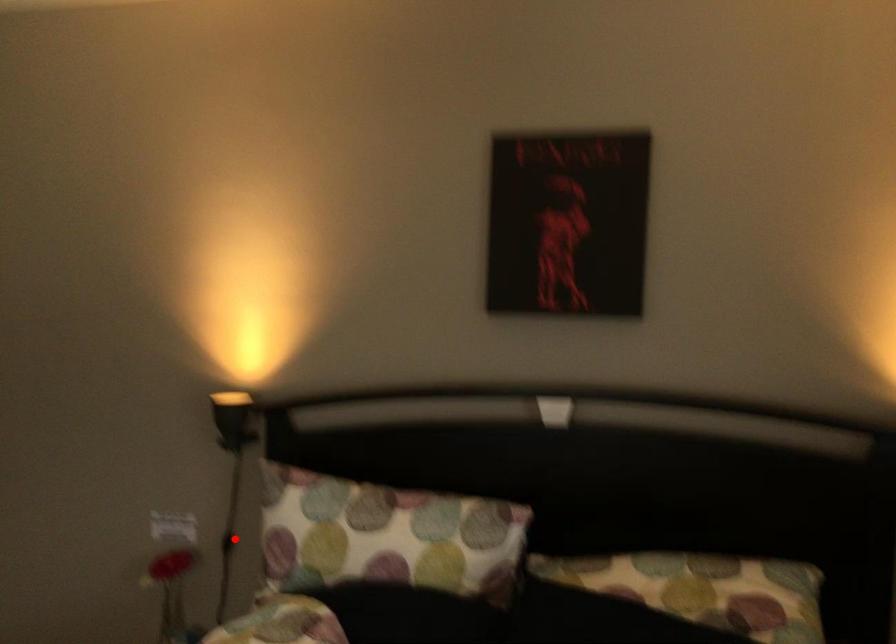
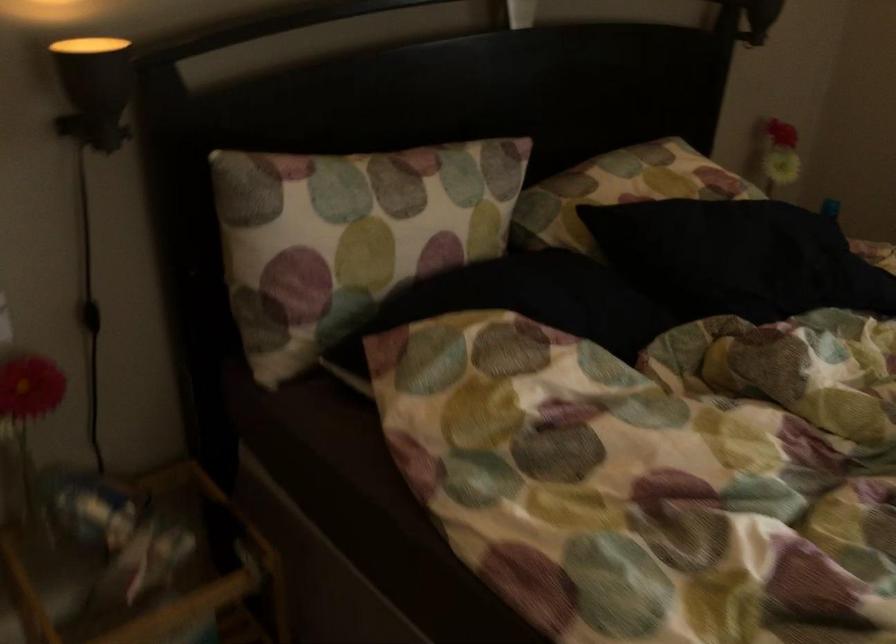
Where in the second image is the point corresponding to the highlighted location from the first image?

(90, 316)